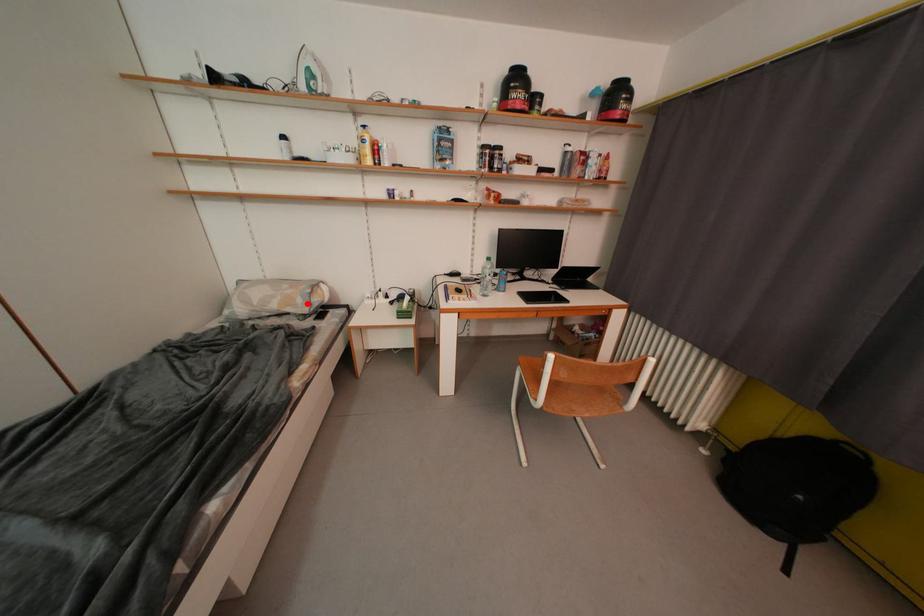
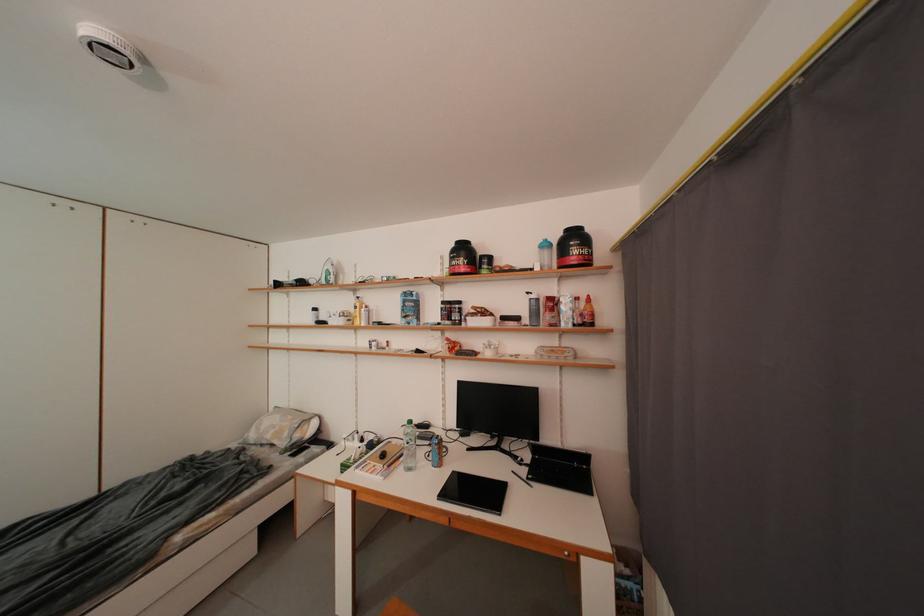
Question: I am providing you with two images of the same scene from different viewpoints. In image1, a red point is highlighted. Considering the same 3D point in image2, which of the following is correct?

Choices:
 (A) It is closer
 (B) It is farther

Answer: (B)